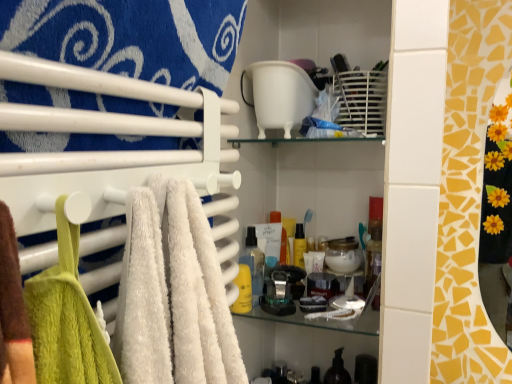
From the picture: How much space does yellow matte bottle at center, arranged as the second toiletry when ordered from the bottom, occupy vertically?

It is 4.25 inches.

This screenshot has height=384, width=512. In order to click on white soft towel at left in this screenshot , I will do `click(131, 37)`.

Identify the location of translucent plastic soap dispenser at lower center, positioned as the 3th toiletry in front-to-back order. (337, 370).

The height and width of the screenshot is (384, 512). I want to click on translucent plastic spray bottle at center, the second toiletry viewed from the right, so click(254, 263).

Which of these two, translucent plastic spray bottle at center, placed as the third toiletry when sorted from bottom to top, or white soft towel at left, is smaller?

With smaller size is translucent plastic spray bottle at center, placed as the third toiletry when sorted from bottom to top.

From a real-world perspective, is translucent plastic spray bottle at center, which is the 2th toiletry in back-to-front order, positioned under white soft towel at left based on gravity?

Yes, from a real-world perspective, translucent plastic spray bottle at center, which is the 2th toiletry in back-to-front order, is below white soft towel at left.

Based on the photo, is translucent plastic spray bottle at center, which is the 2th toiletry in back-to-front order, positioned beyond the bounds of white soft towel at left?

Yes, translucent plastic spray bottle at center, which is the 2th toiletry in back-to-front order, is not within white soft towel at left.

From the image's perspective, is translucent plastic spray bottle at center, which is the second toiletry from left to right, above or below translucent plastic soap dispenser at lower center, which is the 1th toiletry from right to left?

From the image's perspective, translucent plastic spray bottle at center, which is the second toiletry from left to right, appears above translucent plastic soap dispenser at lower center, which is the 1th toiletry from right to left.

How different are the orientations of translucent plastic spray bottle at center, which is the second toiletry from left to right, and translucent plastic soap dispenser at lower center, arranged as the first toiletry when viewed from the back, in degrees?

The angular difference between translucent plastic spray bottle at center, which is the second toiletry from left to right, and translucent plastic soap dispenser at lower center, arranged as the first toiletry when viewed from the back, is 2.85 degrees.

Is translucent plastic spray bottle at center, the second toiletry viewed from the right, far from translucent plastic soap dispenser at lower center, which is the 1th toiletry from right to left?

No, there isn't a large distance between translucent plastic spray bottle at center, the second toiletry viewed from the right, and translucent plastic soap dispenser at lower center, which is the 1th toiletry from right to left.

Which point is more forward, (208, 69) or (342, 369)?

The point (208, 69) is closer.

In terms of width, does white soft towel at left look wider or thinner when compared to translucent plastic soap dispenser at lower center, which is the 1th toiletry from right to left?

Considering their sizes, white soft towel at left looks slimmer than translucent plastic soap dispenser at lower center, which is the 1th toiletry from right to left.

Could you tell me if white soft towel at left is turned towards translucent plastic soap dispenser at lower center, which is the first toiletry from bottom to top?

No.

Considering the relative positions of white soft towel at left and yellow matte bottle at center, positioned as the 3th toiletry in back-to-front order, in the image provided, is white soft towel at left behind yellow matte bottle at center, positioned as the 3th toiletry in back-to-front order,?

That is False.

Is white soft towel at left positioned with its back to yellow matte bottle at center, which is the 1th toiletry in front-to-back order?

No.

Is white soft towel at left with yellow matte bottle at center, the third toiletry positioned from the right?

They are not placed beside each other.

Considering the sizes of white soft towel at left and yellow matte bottle at center, arranged as the second toiletry when ordered from the bottom, in the image, is white soft towel at left taller or shorter than yellow matte bottle at center, arranged as the second toiletry when ordered from the bottom,?

In the image, white soft towel at left appears to be taller than yellow matte bottle at center, arranged as the second toiletry when ordered from the bottom.

Is white soft towel at left oriented towards translucent plastic spray bottle at center, placed as the third toiletry when sorted from bottom to top?

No.

Between point (117, 10) and point (254, 279), which one is positioned in front?

Point (117, 10)

Between white soft towel at left and translucent plastic spray bottle at center, the second toiletry from the front, which one is positioned in front?

white soft towel at left is more forward.

From a real-world perspective, between translucent plastic soap dispenser at lower center, positioned as the 3th toiletry in front-to-back order, and translucent plastic spray bottle at center, which is the 2th toiletry in back-to-front order, who is vertically lower?

translucent plastic soap dispenser at lower center, positioned as the 3th toiletry in front-to-back order.

Between point (344, 380) and point (246, 262), which one is positioned in front?

Point (246, 262)

Is translucent plastic soap dispenser at lower center, arranged as the first toiletry when viewed from the back, in front of or behind translucent plastic spray bottle at center, the 1th toiletry when ordered from top to bottom, in the image?

translucent plastic soap dispenser at lower center, arranged as the first toiletry when viewed from the back, is behind translucent plastic spray bottle at center, the 1th toiletry when ordered from top to bottom.

From the image's perspective, would you say translucent plastic soap dispenser at lower center, which is the first toiletry from bottom to top, is positioned over translucent plastic spray bottle at center, placed as the third toiletry when sorted from bottom to top?

Incorrect, from the image's perspective, translucent plastic soap dispenser at lower center, which is the first toiletry from bottom to top, is lower than translucent plastic spray bottle at center, placed as the third toiletry when sorted from bottom to top.

Between yellow matte bottle at center, the 1th toiletry when ordered from left to right, and white soft towel at left, which one appears on the left side from the viewer's perspective?

white soft towel at left.

Based on the photo, from the image's perspective, between yellow matte bottle at center, which is the 1th toiletry in front-to-back order, and white soft towel at left, which one is located above?

white soft towel at left.

Between yellow matte bottle at center, arranged as the second toiletry when ordered from the bottom, and white soft towel at left, which one has more height?

Standing taller between the two is white soft towel at left.

Is the depth of yellow matte bottle at center, the 1th toiletry when ordered from left to right, greater than that of white soft towel at left?

Yes, the depth of yellow matte bottle at center, the 1th toiletry when ordered from left to right, is greater than that of white soft towel at left.

Identify the location of towel above the translucent plastic spray bottle at center, placed as the third toiletry when sorted from bottom to top (from a real-world perspective). This screenshot has height=384, width=512. (131, 37).

Which toiletry is the 1st one when counting from the left side of the translucent plastic soap dispenser at lower center, arranged as the first toiletry when viewed from the back? Please provide its 2D coordinates.

[(254, 263)]

Based on their spatial positions, is yellow matte bottle at center, which is the 1th toiletry in front-to-back order, or translucent plastic spray bottle at center, which is the 2th toiletry in back-to-front order, closer to translucent plastic soap dispenser at lower center, which is counted as the 3th toiletry, starting from the left?

Among the two, yellow matte bottle at center, which is the 1th toiletry in front-to-back order, is located nearer to translucent plastic soap dispenser at lower center, which is counted as the 3th toiletry, starting from the left.

Considering their positions, is translucent plastic soap dispenser at lower center, arranged as the first toiletry when viewed from the back, positioned closer to translucent plastic spray bottle at center, which is the 2th toiletry in back-to-front order, than white soft towel at left?

translucent plastic soap dispenser at lower center, arranged as the first toiletry when viewed from the back.

Estimate the real-world distances between objects in this image. Which object is closer to yellow matte bottle at center, the third toiletry positioned from the right, white soft towel at left or translucent plastic spray bottle at center, which is the 2th toiletry in back-to-front order?

translucent plastic spray bottle at center, which is the 2th toiletry in back-to-front order, is positioned closer to the anchor yellow matte bottle at center, the third toiletry positioned from the right.

Estimate the real-world distances between objects in this image. Which object is closer to translucent plastic soap dispenser at lower center, which is the first toiletry from bottom to top, white soft towel at left or yellow matte bottle at center, the 1th toiletry when ordered from left to right?

Based on the image, yellow matte bottle at center, the 1th toiletry when ordered from left to right, appears to be nearer to translucent plastic soap dispenser at lower center, which is the first toiletry from bottom to top.

From the image, which object appears to be nearer to translucent plastic spray bottle at center, which is the second toiletry from left to right, yellow matte bottle at center, the third toiletry positioned from the right, or white soft towel at left?

yellow matte bottle at center, the third toiletry positioned from the right, is closer to translucent plastic spray bottle at center, which is the second toiletry from left to right.

Looking at the image, which one is located further to white soft towel at left, translucent plastic spray bottle at center, which is the second toiletry from left to right, or yellow matte bottle at center, arranged as the second toiletry when ordered from the bottom?

translucent plastic spray bottle at center, which is the second toiletry from left to right, lies further to white soft towel at left than the other object.

Which object lies further to the anchor point translucent plastic spray bottle at center, which is the second toiletry from left to right, translucent plastic soap dispenser at lower center, positioned as the 3th toiletry in top-to-bottom order, or yellow matte bottle at center, arranged as the second toiletry when ordered from the bottom?

Based on the image, translucent plastic soap dispenser at lower center, positioned as the 3th toiletry in top-to-bottom order, appears to be further to translucent plastic spray bottle at center, which is the second toiletry from left to right.

When comparing their distances from white soft towel at left, does yellow matte bottle at center, the 1th toiletry when ordered from left to right, or translucent plastic spray bottle at center, the second toiletry from the front, seem further?

translucent plastic spray bottle at center, the second toiletry from the front, lies further to white soft towel at left than the other object.

Locate an element on the screen. toiletry between translucent plastic spray bottle at center, which is the 2th toiletry in back-to-front order, and translucent plastic soap dispenser at lower center, which is the first toiletry from bottom to top, in the up-down direction is located at coordinates (243, 290).

Identify the location of toiletry between white soft towel at left and translucent plastic spray bottle at center, the second toiletry viewed from the right, along the z-axis. (243, 290).